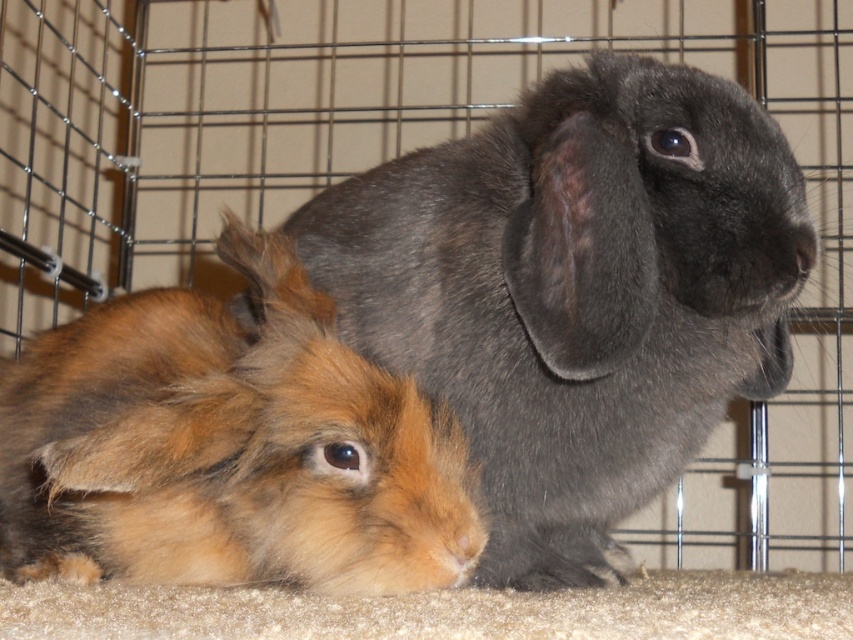
Question: Which object is farther from the camera taking this photo?

Choices:
 (A) brown fluffy rabbit at lower left
 (B) gray soft fur rabbit at center

Answer: (B)

Question: Does gray soft fur rabbit at center have a greater width compared to brown fluffy rabbit at lower left?

Choices:
 (A) yes
 (B) no

Answer: (B)

Question: Which object is farther from the camera taking this photo?

Choices:
 (A) gray soft fur rabbit at center
 (B) brown fluffy rabbit at lower left

Answer: (A)

Question: Considering the relative positions of gray soft fur rabbit at center and brown fluffy rabbit at lower left in the image provided, where is gray soft fur rabbit at center located with respect to brown fluffy rabbit at lower left?

Choices:
 (A) below
 (B) above

Answer: (B)

Question: Can you confirm if gray soft fur rabbit at center is wider than brown fluffy rabbit at lower left?

Choices:
 (A) no
 (B) yes

Answer: (A)